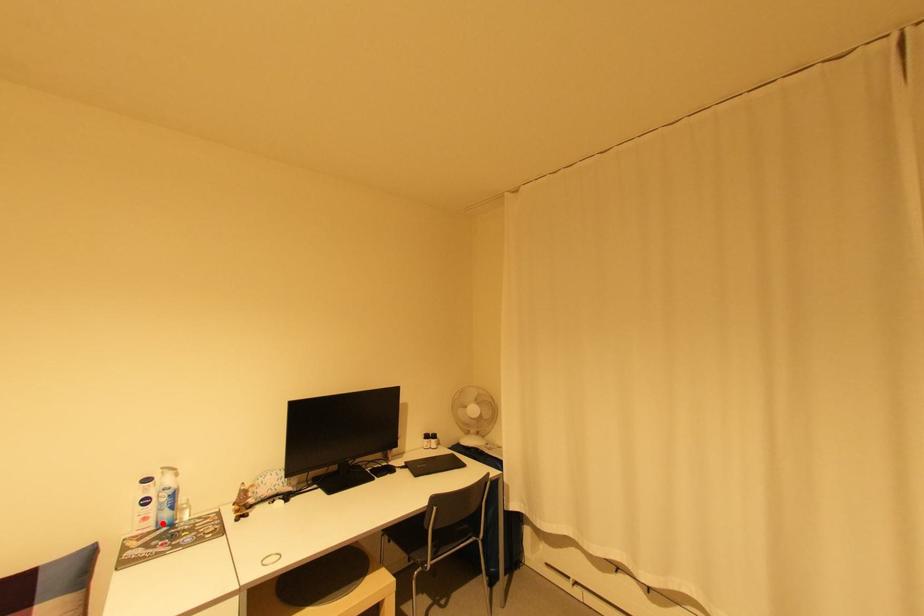
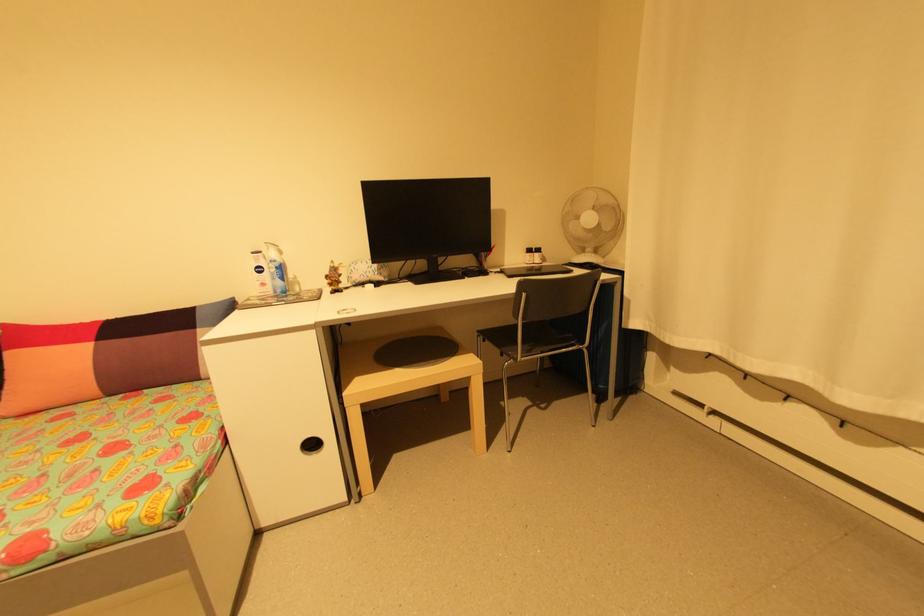
In the second image, find the point that corresponds to the highlighted location in the first image.

(280, 291)